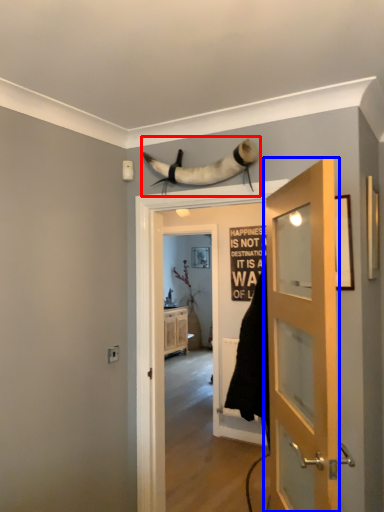
Question: Which point is further to the camera, animal (highlighted by a red box) or door (highlighted by a blue box)?

Choices:
 (A) animal
 (B) door

Answer: (A)